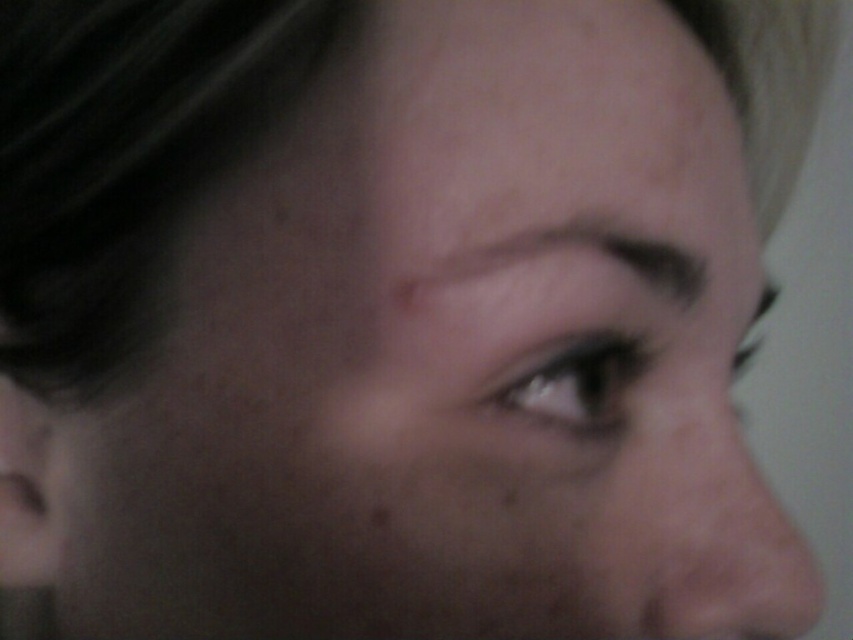
You are a makeup artist preparing to apply foundation. You notice the pink smooth skin at lower right and the smokey gray eye at center. Which area requires more foundation coverage based on their sizes?

The pink smooth skin at lower right requires more foundation coverage because its width is larger than the smokey gray eye at center.

You are a makeup artist preparing for a client consultation. You need to ensure that the distance between the dark brown eyebrow at upper center and the smokey gray eye at center is sufficient for applying eyeliner. The recommended minimum distance is 0.8 inches. Based on the image provided, will you be able to apply the eyeliner comfortably?

The distance between the dark brown eyebrow at upper center and the smokey gray eye at center is 0.79 inches, which is slightly less than the recommended minimum of 0.8 inches. This may make applying eyeliner comfortably challenging.

From the picture: You are a makeup artist preparing to apply foundation. You see the pink smooth skin at lower right and the smokey gray eye at center. Which area requires more foundation coverage based on their sizes?

The pink smooth skin at lower right requires more foundation coverage because it has a larger size compared to the smokey gray eye at center.